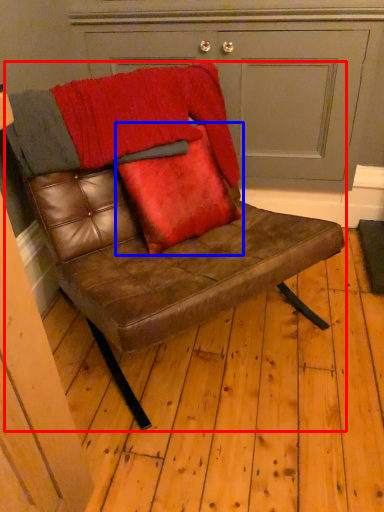
Question: Which point is closer to the camera, chair (highlighted by a red box) or throw pillow (highlighted by a blue box)?

Choices:
 (A) chair
 (B) throw pillow

Answer: (A)